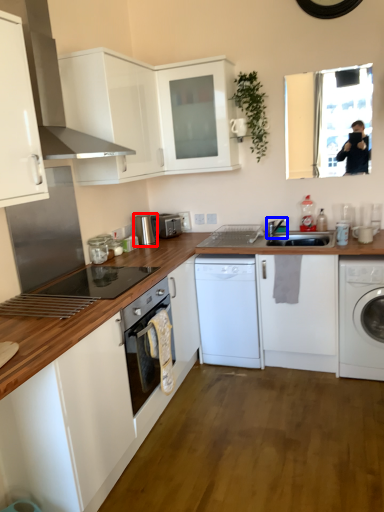
Question: Which object is closer to the camera taking this photo, kitchen appliance (highlighted by a red box) or tap (highlighted by a blue box)?

Choices:
 (A) kitchen appliance
 (B) tap

Answer: (B)